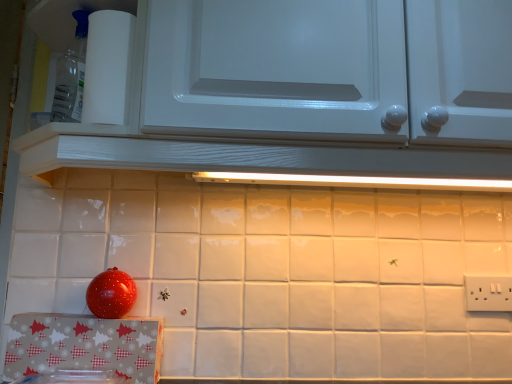
This screenshot has height=384, width=512. Describe the element at coordinates (71, 74) in the screenshot. I see `white paper towel at upper left` at that location.

This screenshot has width=512, height=384. What do you see at coordinates (305, 91) in the screenshot? I see `white glossy cabinet at upper center` at bounding box center [305, 91].

Locate an element on the screen. The width and height of the screenshot is (512, 384). white plastic electric outlet at lower right is located at coordinates (488, 293).

Is white paper towel at upper left located within white glossy cabinet at upper center?

Yes, white glossy cabinet at upper center contains white paper towel at upper left.

Which of these two, white glossy cabinet at upper center or white paper towel at upper left, stands taller?

Standing taller between the two is white glossy cabinet at upper center.

From the image's perspective, is white glossy cabinet at upper center above or below white paper towel at upper left?

Clearly, from the image's perspective, white glossy cabinet at upper center is above white paper towel at upper left.

From a real-world perspective, relative to white paper towel at upper left, is white glossy cabinet at upper center vertically above or below?

From a real-world perspective, white glossy cabinet at upper center is physically above white paper towel at upper left.

Where is `electric outlet below the white glossy cabinet at upper center (from the image's perspective)`? electric outlet below the white glossy cabinet at upper center (from the image's perspective) is located at coordinates (488, 293).

Can you confirm if white glossy cabinet at upper center is positioned to the left of white plastic electric outlet at lower right?

Indeed, white glossy cabinet at upper center is positioned on the left side of white plastic electric outlet at lower right.

Could you tell me if white glossy cabinet at upper center is turned towards white plastic electric outlet at lower right?

No.

Is white glossy cabinet at upper center far from white plastic electric outlet at lower right?

No, there isn't a large distance between white glossy cabinet at upper center and white plastic electric outlet at lower right.

Which of these two, white paper towel at upper left or white glossy cabinet at upper center, is bigger?

white glossy cabinet at upper center.

Is white paper towel at upper left taller or shorter than white glossy cabinet at upper center?

Considering their sizes, white paper towel at upper left has less height than white glossy cabinet at upper center.

Does point (57, 112) appear closer or farther from the camera than point (388, 51)?

Point (57, 112).

Which is behind, white paper towel at upper left or white plastic electric outlet at lower right?

Positioned behind is white plastic electric outlet at lower right.

Is white plastic electric outlet at lower right at the back of white paper towel at upper left?

No, white paper towel at upper left is not facing away from white plastic electric outlet at lower right.

Is white paper towel at upper left far away from white plastic electric outlet at lower right?

Indeed, white paper towel at upper left is not near white plastic electric outlet at lower right.

Is white paper towel at upper left at the right side of white plastic electric outlet at lower right?

Incorrect, white paper towel at upper left is not on the right side of white plastic electric outlet at lower right.

Which is less distant, [494,294] or [303,114]?

Point [494,294].

Could you measure the distance between white plastic electric outlet at lower right and white glossy cabinet at upper center?

The distance of white plastic electric outlet at lower right from white glossy cabinet at upper center is 65.02 centimeters.

Considering the sizes of white plastic electric outlet at lower right and white glossy cabinet at upper center in the image, is white plastic electric outlet at lower right bigger or smaller than white glossy cabinet at upper center?

A: In the image, white plastic electric outlet at lower right appears to be smaller than white glossy cabinet at upper center.

Can you tell me how much white plastic electric outlet at lower right and white glossy cabinet at upper center differ in facing direction?

There is a 0.543-degree angle between the facing directions of white plastic electric outlet at lower right and white glossy cabinet at upper center.

Does point (471, 280) come behind point (73, 67)?

Yes, point (471, 280) is farther from viewer.

In terms of size, does white plastic electric outlet at lower right appear bigger or smaller than white paper towel at upper left?

In the image, white plastic electric outlet at lower right appears to be smaller than white paper towel at upper left.

Is white plastic electric outlet at lower right not within white paper towel at upper left?

Yes, white plastic electric outlet at lower right is located beyond the bounds of white paper towel at upper left.

Identify the location of appliance below the white glossy cabinet at upper center (from a real-world perspective). This screenshot has width=512, height=384. (71, 74).

Locate an element on the screen. The width and height of the screenshot is (512, 384). cabinetry on the left of white plastic electric outlet at lower right is located at coordinates (305, 91).

Which object lies nearer to the anchor point white paper towel at upper left, white glossy cabinet at upper center or white plastic electric outlet at lower right?

white glossy cabinet at upper center lies closer to white paper towel at upper left than the other object.

Consider the image. Based on their spatial positions, is white plastic electric outlet at lower right or white paper towel at upper left further from white glossy cabinet at upper center?

white plastic electric outlet at lower right is positioned further to the anchor white glossy cabinet at upper center.

Consider the image. When comparing their distances from white glossy cabinet at upper center, does white paper towel at upper left or white plastic electric outlet at lower right seem closer?

white paper towel at upper left lies closer to white glossy cabinet at upper center than the other object.

When comparing their distances from white plastic electric outlet at lower right, does white paper towel at upper left or white glossy cabinet at upper center seem closer?

Based on the image, white glossy cabinet at upper center appears to be nearer to white plastic electric outlet at lower right.

Considering their positions, is white glossy cabinet at upper center positioned closer to white plastic electric outlet at lower right than white paper towel at upper left?

Among the two, white glossy cabinet at upper center is located nearer to white plastic electric outlet at lower right.

When comparing their distances from white paper towel at upper left, does white plastic electric outlet at lower right or white glossy cabinet at upper center seem further?

The object further to white paper towel at upper left is white plastic electric outlet at lower right.

You are a GUI agent. You are given a task and a screenshot of the screen. Output one action in this format:
    pyautogui.click(x=<x>, y=<y>)
    Task: Click on the cabinetry situated between white paper towel at upper left and white plastic electric outlet at lower right from left to right
    The height and width of the screenshot is (384, 512).
    Given the screenshot: What is the action you would take?
    pyautogui.click(x=305, y=91)